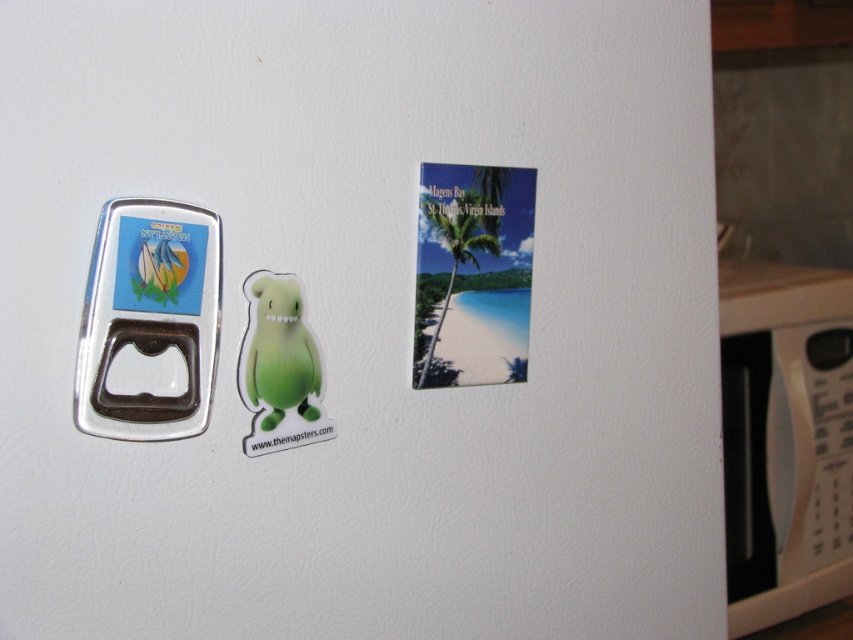
You are organizing the items on the refrigerator. You want to place a new magnet between the metallic silver bottle opener at left and the green rubber toy at center. Based on their current positions, where should you place the new magnet?

The metallic silver bottle opener at left is located above the green rubber toy at center, so the new magnet should be placed between them either below the bottle opener and above the green rubber toy at center or in the space between their positions.

You are trying to place a new magnet on the refrigerator. The magnet is 10 cm wide. The white plastic microwave at right is 12 cm tall and the metallic silver bottle opener at left is 8 cm tall. Can the magnet fit vertically between them?

The white plastic microwave at right is taller than the metallic silver bottle opener at left. The height difference is 4 cm. Since the magnet is 10 cm wide, which is less than the 12 cm height of the microwave, the magnet can fit vertically between them as long as there is enough horizontal space.

You are standing in the kitchen and want to reach both the white plastic microwave at right and the metallic silver bottle opener at left. Which one can you grab first without moving your feet?

You can grab the white plastic microwave at right first because it is closer to you than the metallic silver bottle opener at left.